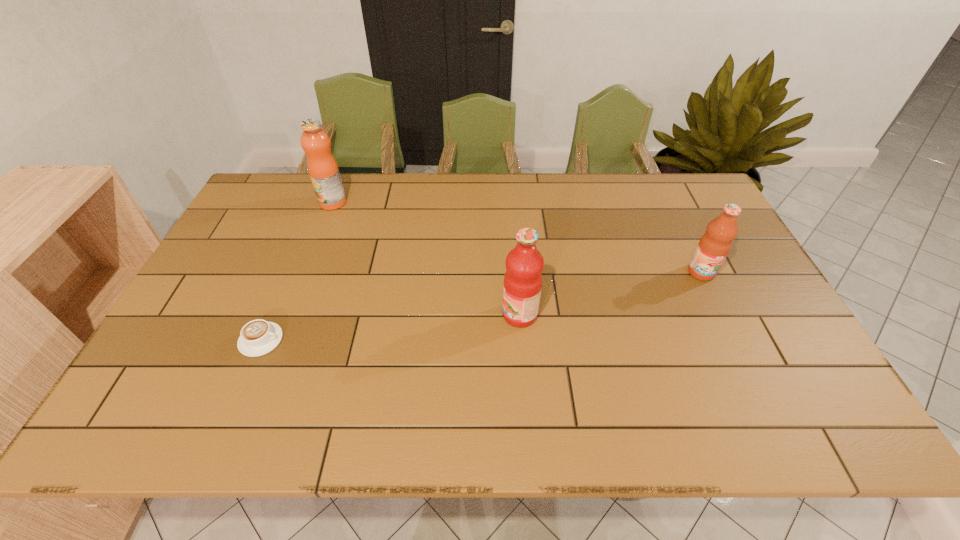
The width and height of the screenshot is (960, 540). In order to click on vacant space that satisfies the following two spatial constraints: 1. on the front side of the leftmost fruit juice; 2. with the handle on the right side of the cappuccino in this screenshot , I will do `click(280, 340)`.

Identify the location of free space that satisfies the following two spatial constraints: 1. on the front side of the farthest fruit juice; 2. with the handle on the right side of the shortest object. (280, 340).